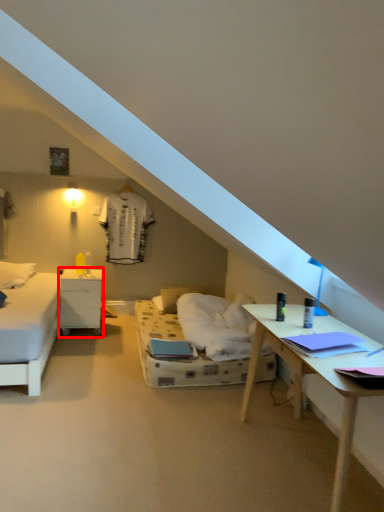
Question: From the image, what is the correct spatial relationship of nightstand (annotated by the red box) in relation to pillow?

Choices:
 (A) right
 (B) left

Answer: (B)